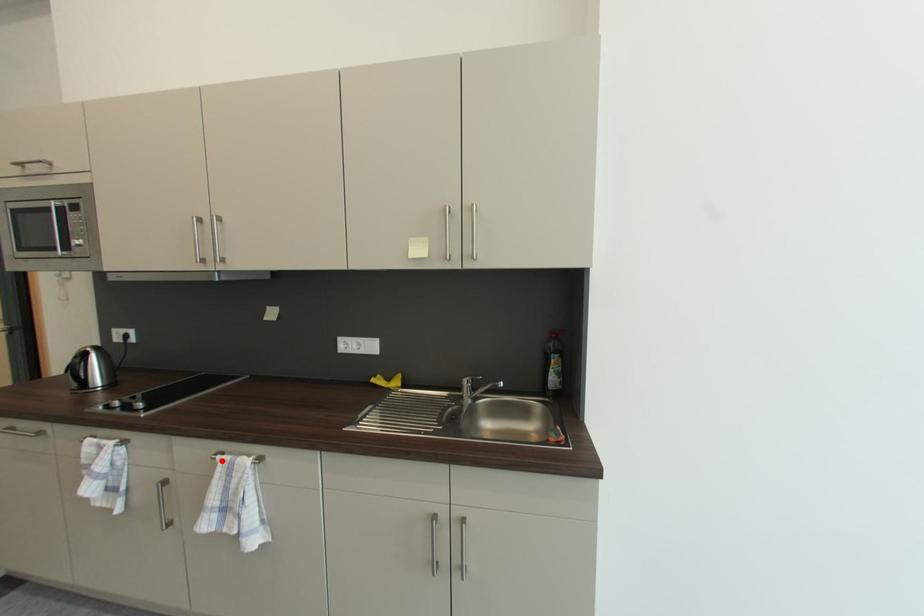
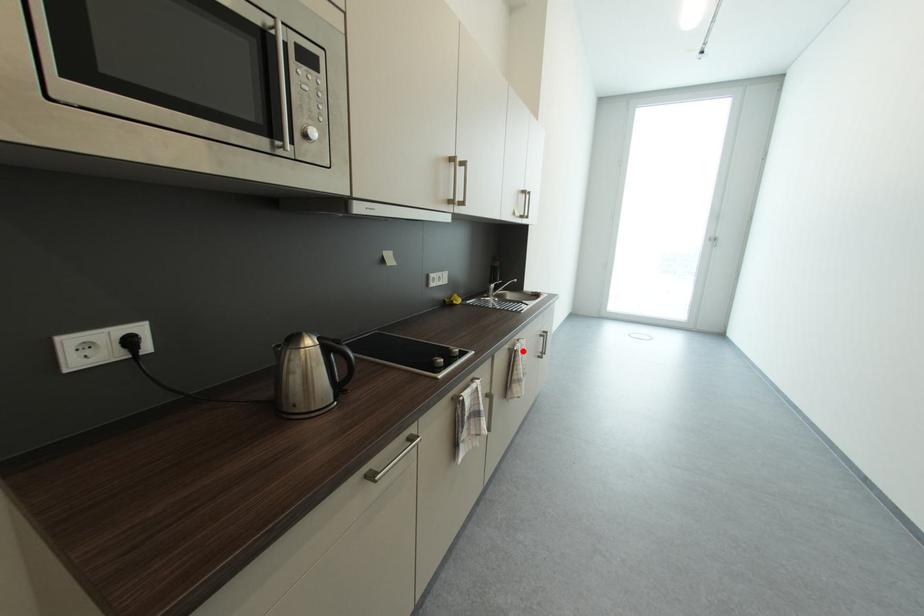
I am providing you with two images of the same scene from different viewpoints. A red point is marked on the first image and another point is marked on the second image. Does the point marked in image1 correspond to the same location as the one in image2?

Yes